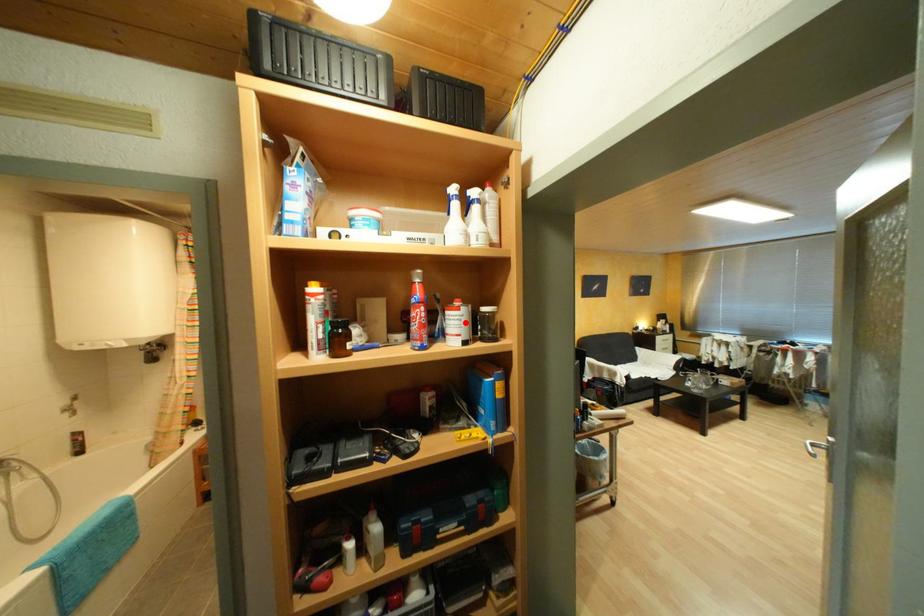
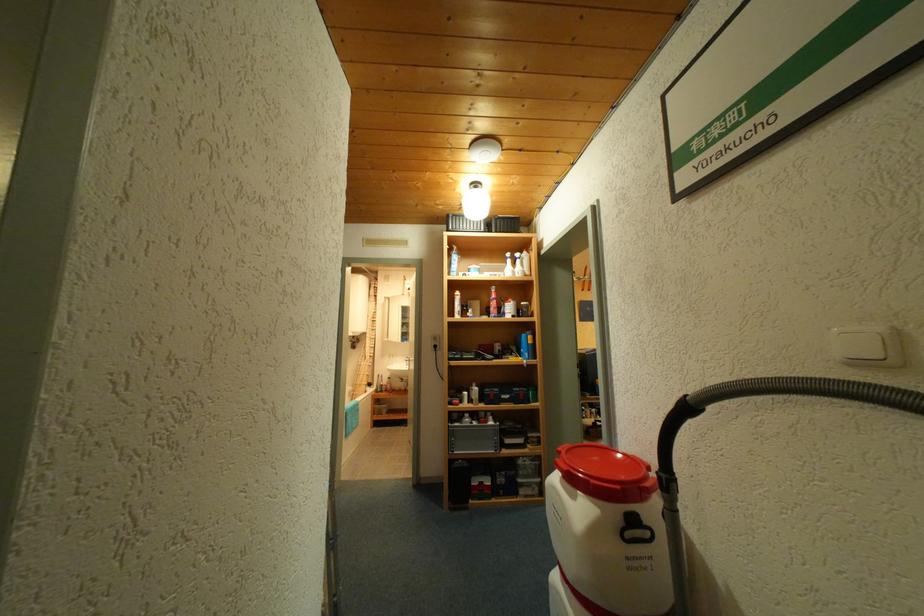
Question: I am providing you with two images of the same scene from different viewpoints. A red point is marked on the first image. Is the red point's position out of view in image 2?

Choices:
 (A) Yes
 (B) No

Answer: (B)